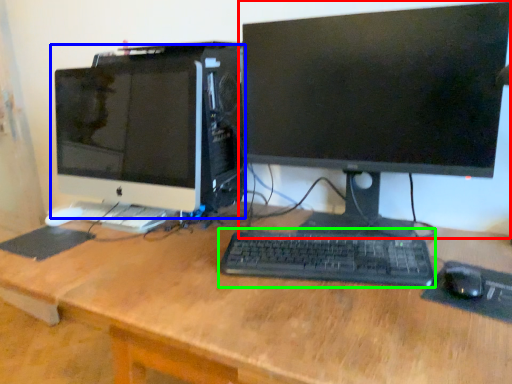
Question: Considering the real-world distances, which object is farthest from computer monitor (highlighted by a red box)? computer monitor (highlighted by a blue box) or computer keyboard (highlighted by a green box)?

Choices:
 (A) computer monitor
 (B) computer keyboard

Answer: (A)